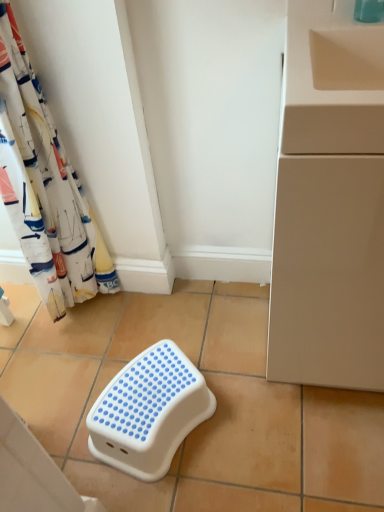
Locate an element on the screen. This screenshot has width=384, height=512. vacant space in front of white fabric curtain at left is located at coordinates (85, 347).